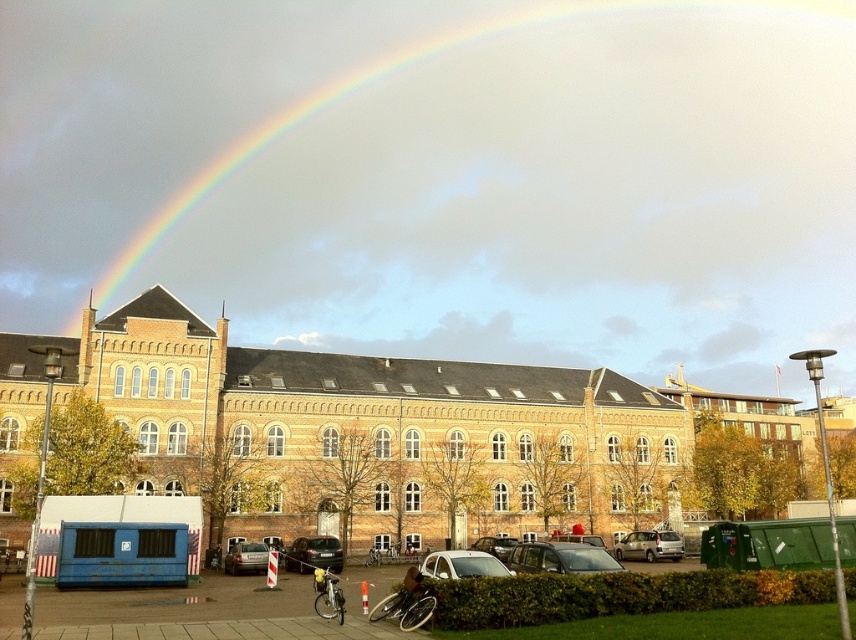
You are a city planner assessing the safety of the parking area in front of the historic brick building. You notice the rainbow at upper center and the matte silver car at center. Given the distance between them, would you recommend installing a new traffic light near the parking area to improve visibility?

The distance between the rainbow at upper center and the matte silver car at center is 373.19 feet. Since the rainbow is a natural weather phenomenon and not a physical object, it does not affect traffic safety. Therefore, the recommendation for a traffic light should be based on standard traffic flow and visibility conditions unrelated to the rainbow.

You are a delivery driver who needs to park your truck, which is 6 meters long, in the parking area in front of the historic brick building. The parking spot is between the metallic silver car at center and the shiny black car at center. Can your truck fit in this space?

The metallic silver car at center is larger than the shiny black car at center. However, without knowing the exact distance between them, it is impossible to determine if the 6 meter truck can fit. Please check the available space between the two cars.